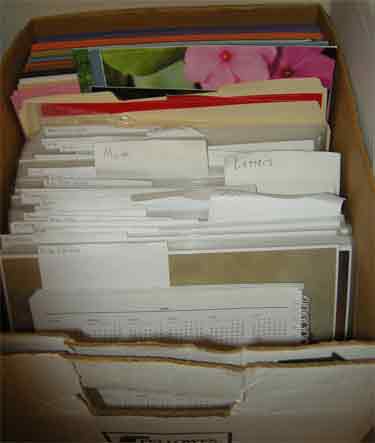
This screenshot has width=375, height=443. I want to click on file folder tab, so click(243, 88).